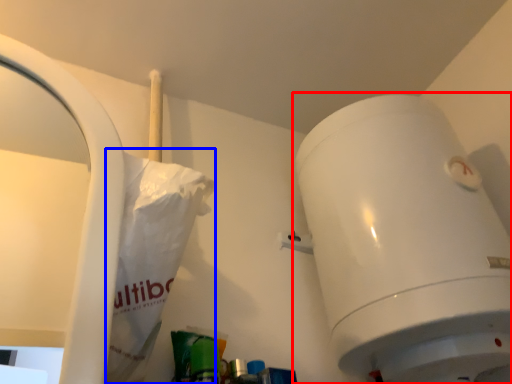
Question: Which object appears farthest to the camera in this image, toilet (highlighted by a red box) or paper bag (highlighted by a blue box)?

Choices:
 (A) toilet
 (B) paper bag

Answer: (A)